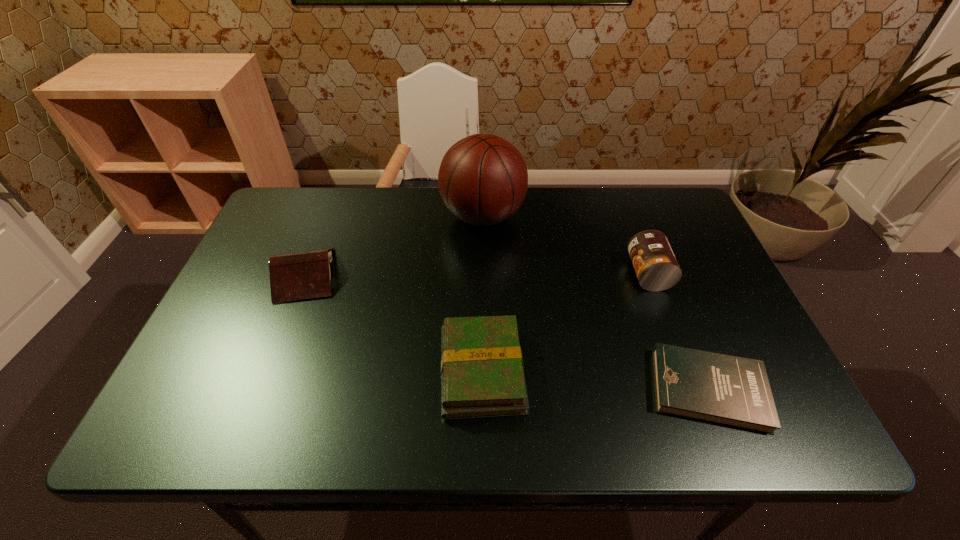
Identify the location of free spot that satisfies the following two spatial constraints: 1. on the front side of the second book from left to right; 2. on the left side of the leftmost object. (269, 370).

At what (x,y) coordinates should I click in order to perform the action: click on free region that satisfies the following two spatial constraints: 1. on the front label of the can; 2. on the right side of the rightmost book. Please return your answer as a coordinate pair (x, y). The image size is (960, 540). Looking at the image, I should click on (691, 390).

Find the location of `blank space that satisfies the following two spatial constraints: 1. on the front label of the can; 2. on the back side of the rightmost book`. blank space that satisfies the following two spatial constraints: 1. on the front label of the can; 2. on the back side of the rightmost book is located at coordinates (691, 390).

Locate an element on the screen. The height and width of the screenshot is (540, 960). vacant area that satisfies the following two spatial constraints: 1. on the back side of the shortest book; 2. on the front label of the second tallest object is located at coordinates (662, 274).

You are a GUI agent. You are given a task and a screenshot of the screen. Output one action in this format:
    pyautogui.click(x=<x>, y=<y>)
    Task: Click on the free spot that satisfies the following two spatial constraints: 1. on the front label of the can; 2. on the front side of the second book from right to left
    
    Given the screenshot: What is the action you would take?
    pyautogui.click(x=684, y=370)

Locate an element on the screen. Image resolution: width=960 pixels, height=540 pixels. vacant space that satisfies the following two spatial constraints: 1. on the front label of the shortest object; 2. on the left side of the can is located at coordinates (691, 390).